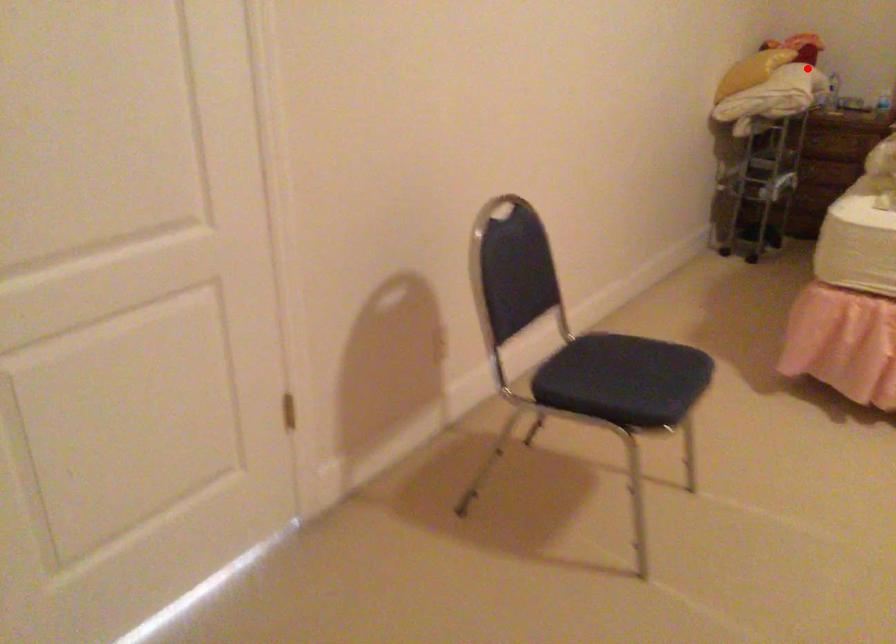
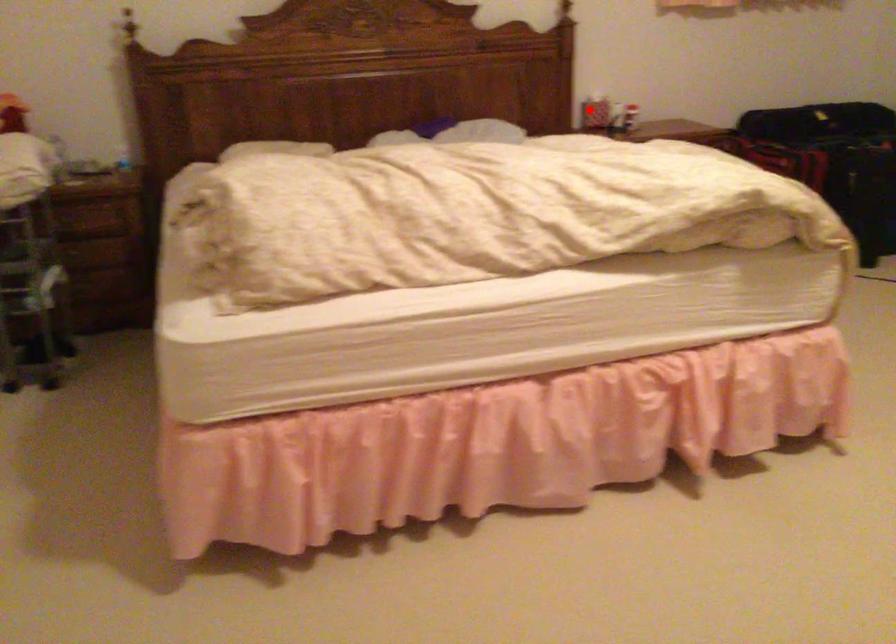
Looking at this image, I am providing you with two images of the same scene from different viewpoints. A red point is marked on the first image and another point is marked on the second image. Is the marked point in image1 the same physical position as the marked point in image2?

No